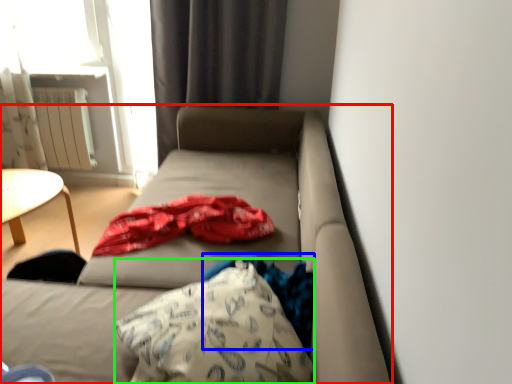
Question: Which object is positioned farthest from studio couch (highlighted by a red box)? Select from clothing (highlighted by a blue box) and throw pillow (highlighted by a green box).

Choices:
 (A) clothing
 (B) throw pillow

Answer: (A)